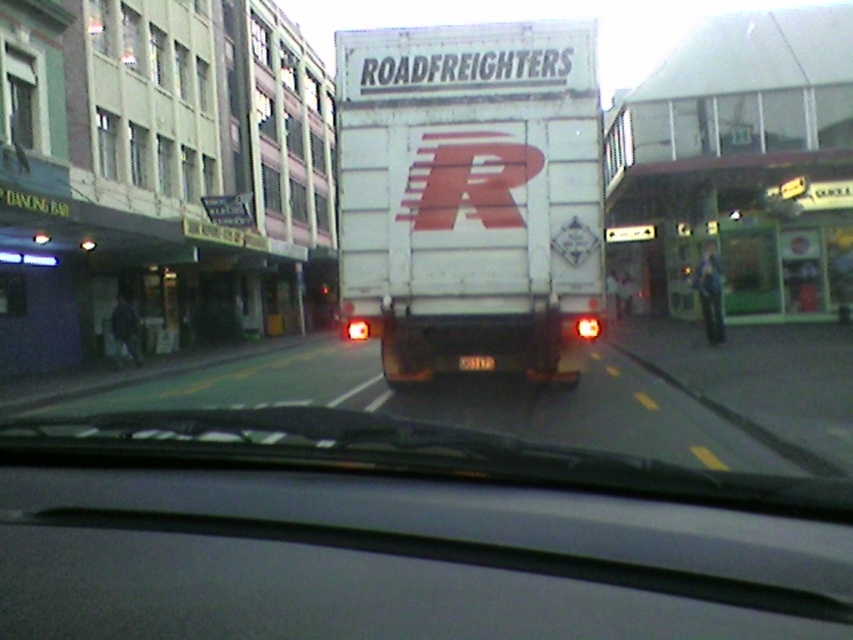
Question: Which point appears closest to the camera in this image?

Choices:
 (A) (485, 368)
 (B) (532, 522)
 (C) (491, 195)

Answer: (B)

Question: Which point appears closest to the camera in this image?

Choices:
 (A) (585, 520)
 (B) (430, 282)

Answer: (A)

Question: Can you confirm if matte black dashboard at center is thinner than black plastic license plate at rear?

Choices:
 (A) yes
 (B) no

Answer: (B)

Question: Is matte black dashboard at center bigger than black plastic license plate at rear?

Choices:
 (A) yes
 (B) no

Answer: (A)

Question: Is white matte trailer truck at center smaller than black plastic license plate at rear?

Choices:
 (A) yes
 (B) no

Answer: (B)

Question: Which of these objects is positioned farthest from the white matte trailer truck at center?

Choices:
 (A) black plastic license plate at rear
 (B) matte black dashboard at center

Answer: (B)